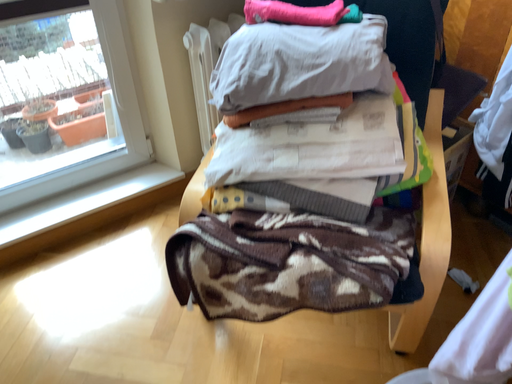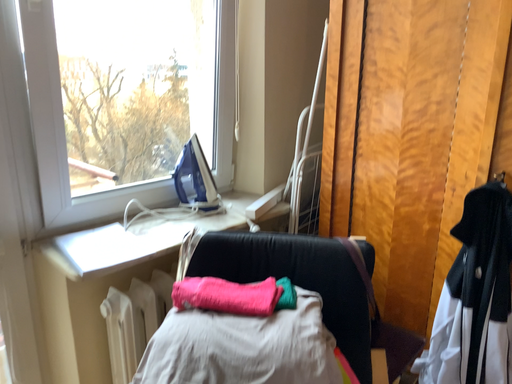
Question: How did the camera likely rotate when shooting the video?

Choices:
 (A) rotated left
 (B) rotated right

Answer: (B)